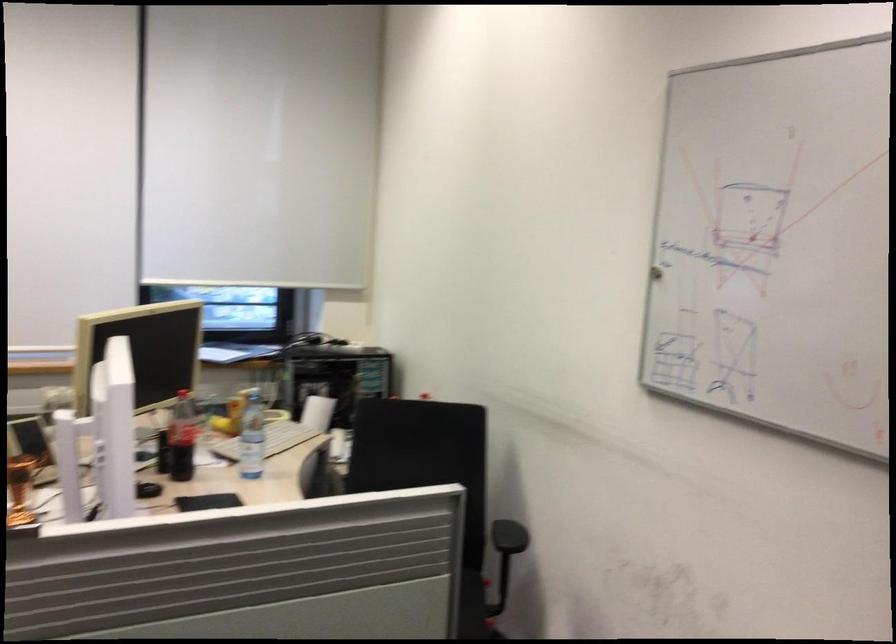
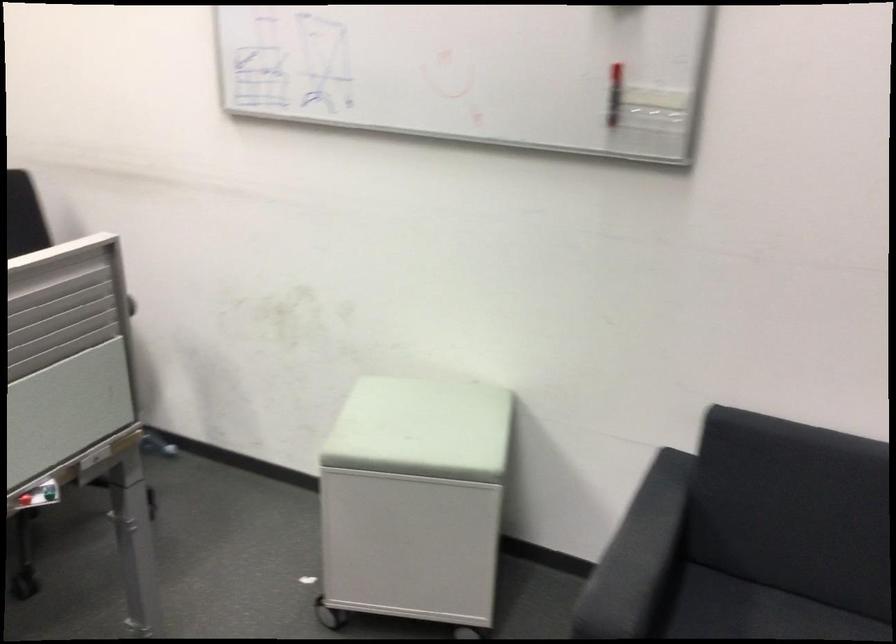
How did the camera likely rotate?

The camera rotated toward right-down.